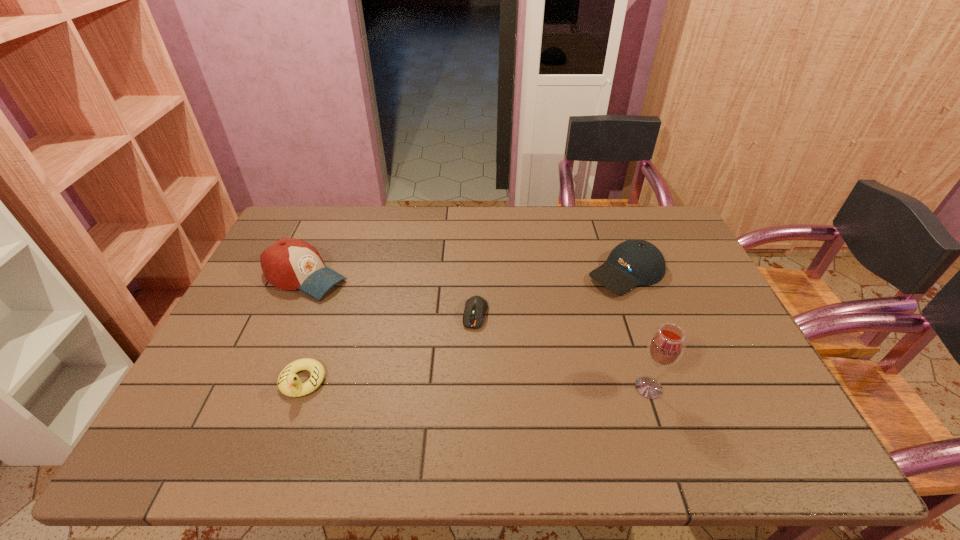
At what (x,y) coordinates should I click in order to perform the action: click on vacant space located 0.130m on the front-facing side of the right baseball cap. Please return your answer as a coordinate pair (x, y). The height and width of the screenshot is (540, 960). Looking at the image, I should click on (569, 308).

Where is `vacant space located 0.100m on the front-facing side of the right baseball cap`? The width and height of the screenshot is (960, 540). vacant space located 0.100m on the front-facing side of the right baseball cap is located at coordinates (577, 303).

This screenshot has height=540, width=960. I want to click on vacant space located 0.120m on the button of the third object from right to left, so click(x=467, y=366).

Where is `free space located on the button of the third object from right to left`? The image size is (960, 540). free space located on the button of the third object from right to left is located at coordinates (468, 353).

The height and width of the screenshot is (540, 960). I want to click on vacant position located 0.170m on the button of the third object from right to left, so click(x=463, y=382).

At what (x,y) coordinates should I click in order to perform the action: click on vacant position located on the front-facing side of the second tallest object. Please return your answer as a coordinate pair (x, y). The height and width of the screenshot is (540, 960). Looking at the image, I should click on (430, 335).

This screenshot has width=960, height=540. Find the location of `blank space located 0.400m on the front-facing side of the second tallest object`. blank space located 0.400m on the front-facing side of the second tallest object is located at coordinates (449, 345).

Identify the location of vacant position located 0.160m on the front-facing side of the second tallest object. The image size is (960, 540). (379, 310).

Identify the location of duckling that is at the near edge. The image size is (960, 540). (289, 383).

This screenshot has width=960, height=540. What are the coordinates of `wineglass that is at the near edge` in the screenshot? It's located at (666, 346).